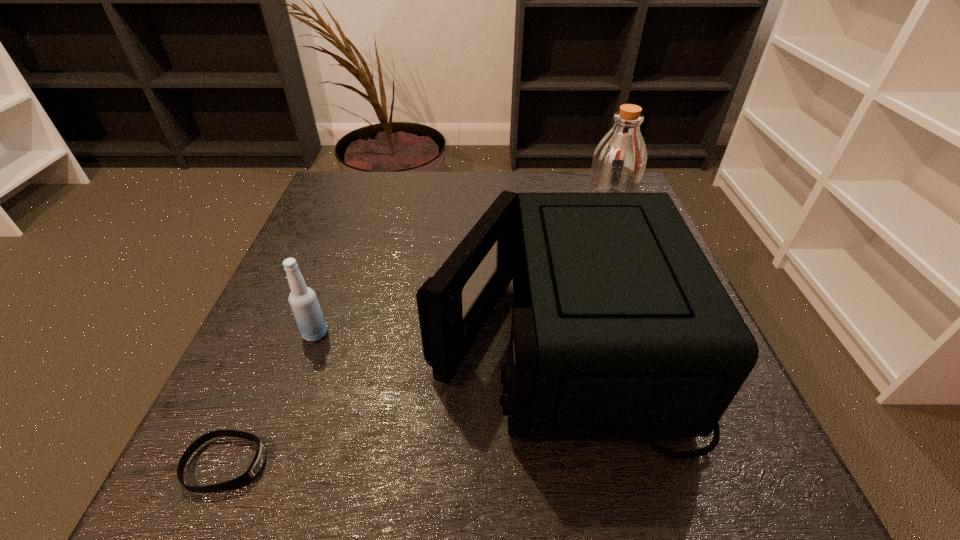
Image resolution: width=960 pixels, height=540 pixels. What are the coordinates of `free space between the microwave oven and the shortest object` in the screenshot? It's located at (393, 400).

Locate an element on the screen. The width and height of the screenshot is (960, 540). free area in between the farthest object and the shortest object is located at coordinates (419, 332).

Identify the location of vacant space in between the shortest object and the second shortest object. (271, 399).

Select which object appears as the third closest to the wristband. Please provide its 2D coordinates. Your answer should be formatted as a tuple, i.e. [(x, y)], where the tuple contains the x and y coordinates of a point satisfying the conditions above.

[(619, 160)]

This screenshot has height=540, width=960. Find the location of `object that stands as the closest to the taller bottle`. object that stands as the closest to the taller bottle is located at coordinates (621, 328).

Identify the location of vacant space that satisfies the following two spatial constraints: 1. on the front side of the farthest object; 2. on the display of the shortest object. The height and width of the screenshot is (540, 960). (719, 464).